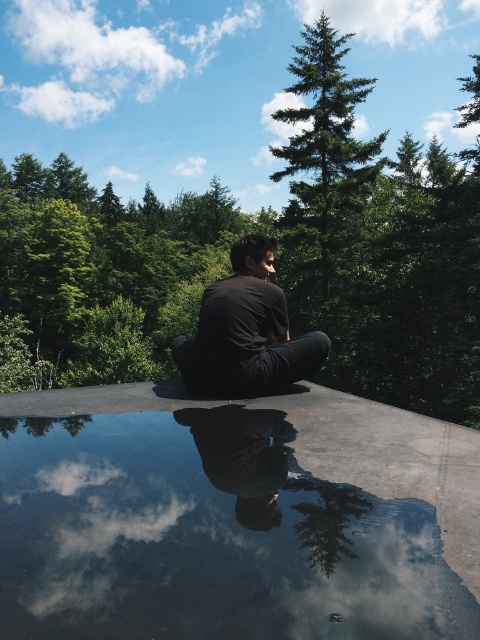
You are a photographer trying to capture the reflection of the person in the image. Since the glossy reflective water at center and the black glossy pants at center are both glossy and dark, which one would you focus on to get a clearer reflection?

The glossy reflective water at center would provide a clearer reflection because it is positioned over the black glossy pants at center, allowing the water to mirror the person and the sky more effectively.

You are a fashion designer observing the serene outdoor scene. You notice the black matte shirt at center and the black glossy pants at center. Which clothing item is located to the left of the other?

The black matte shirt at center is positioned on the left side of black glossy pants at center.